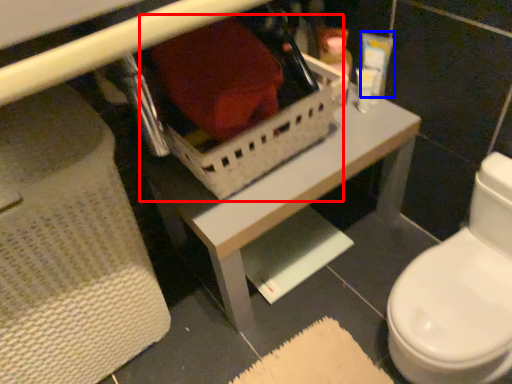
Question: Which object appears closest to the camera in this image, storage box (highlighted by a red box) or toiletry (highlighted by a blue box)?

Choices:
 (A) storage box
 (B) toiletry

Answer: (A)